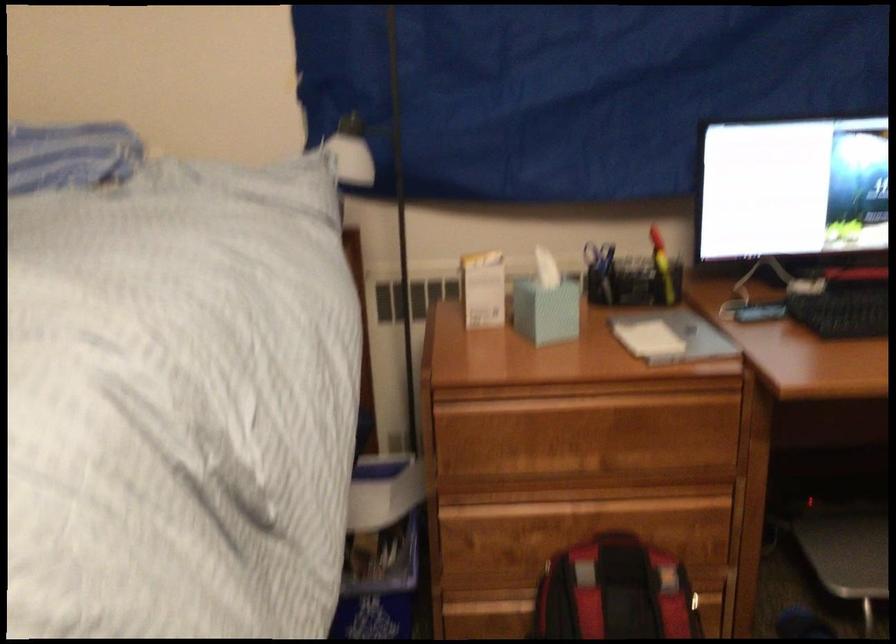
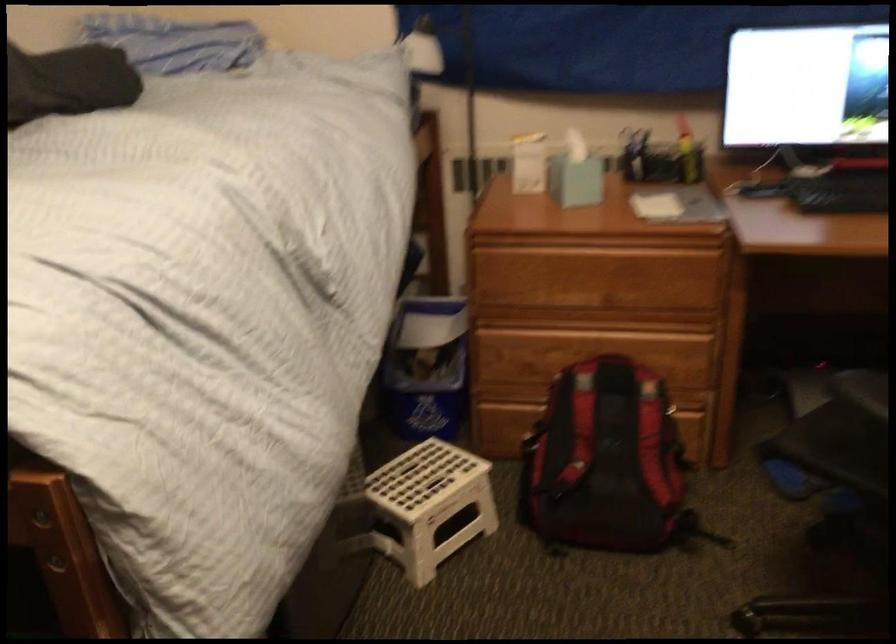
Where in the second image is the point corresponding to (x=363, y=552) from the first image?

(426, 368)